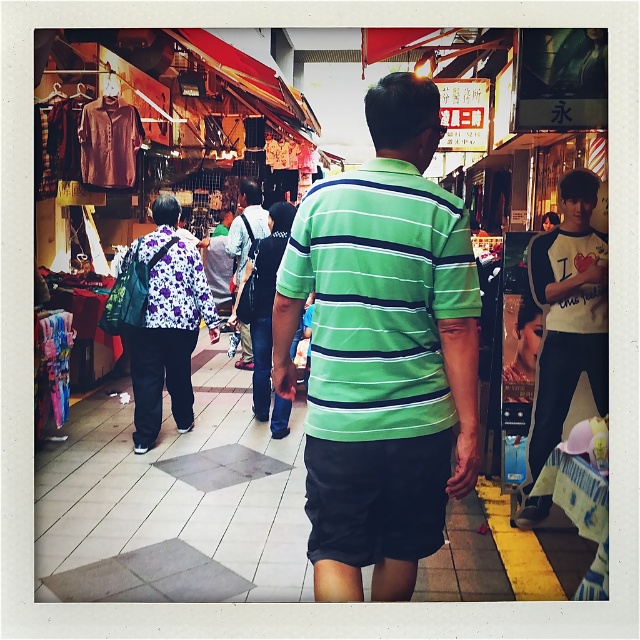
You are a customer at the market and want to buy both the green striped polo shirt at center and the floral fabric shirt at center. Which one is closer to you so you can grab first?

The green striped polo shirt at center is in front of the floral fabric shirt at center, so you can grab the green striped polo shirt at center first.

You are a customer in the market and want to buy both the green striped polo shirt at center and the floral fabric shirt at center. Which one is easier to reach without moving the other?

The green striped polo shirt at center is positioned under the floral fabric shirt at center, so it is easier to reach without moving the other.